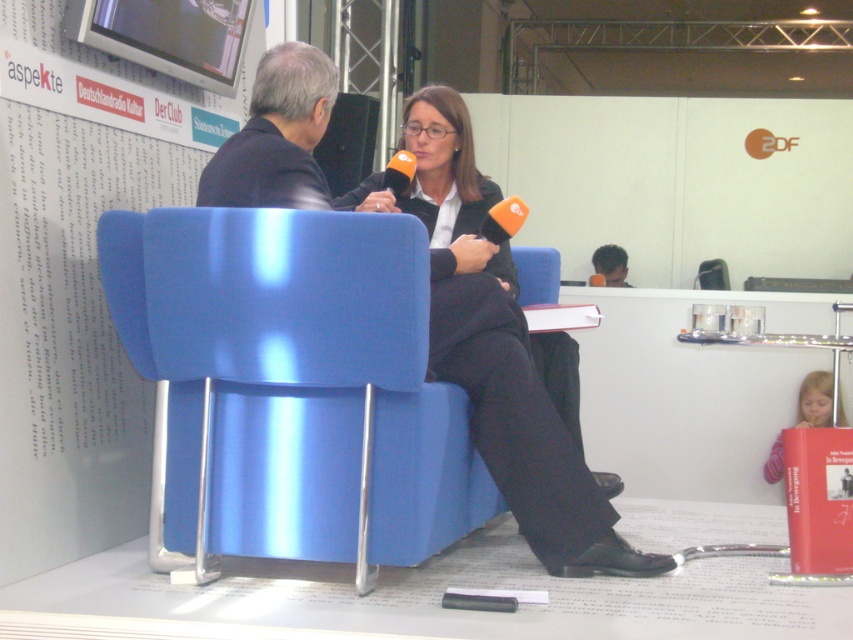
Consider the image. Is matte black blazer at center bigger than matte black suit at center?

Indeed, matte black blazer at center has a larger size compared to matte black suit at center.

Which is in front, point (546, 445) or point (805, 401)?

Point (546, 445)

The width and height of the screenshot is (853, 640). In order to click on matte black blazer at center in this screenshot , I will do coord(492,339).